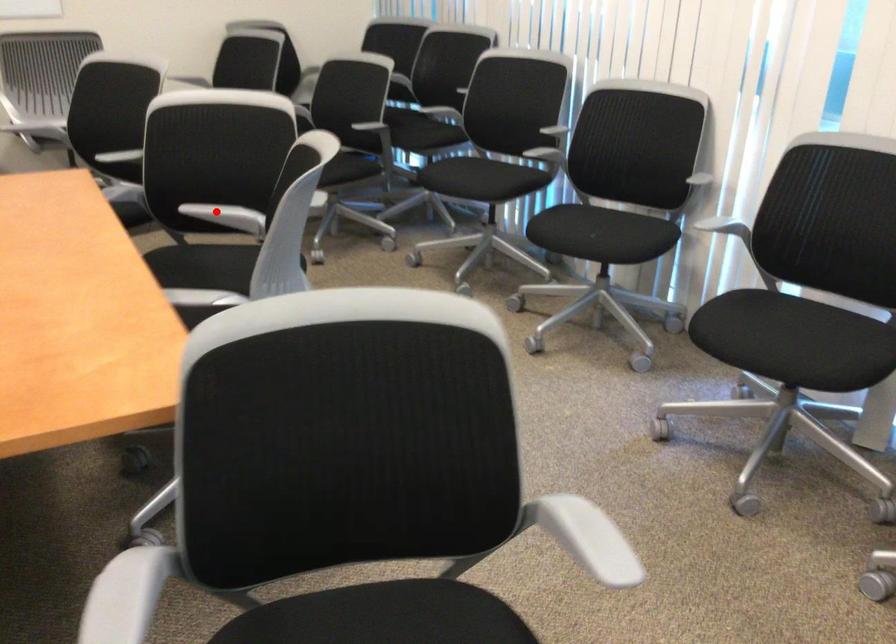
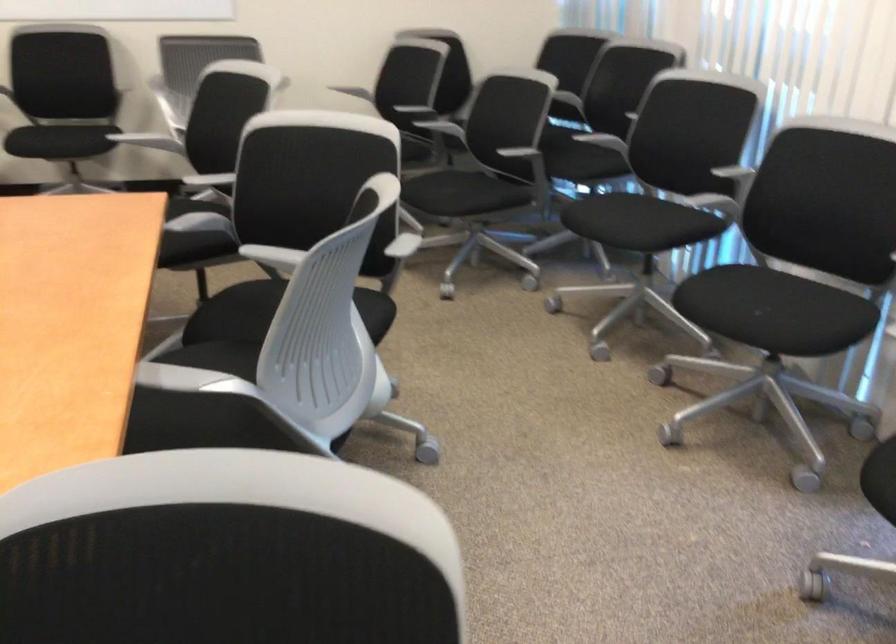
Find the pixel in the second image that matches the highlighted location in the first image.

(273, 258)